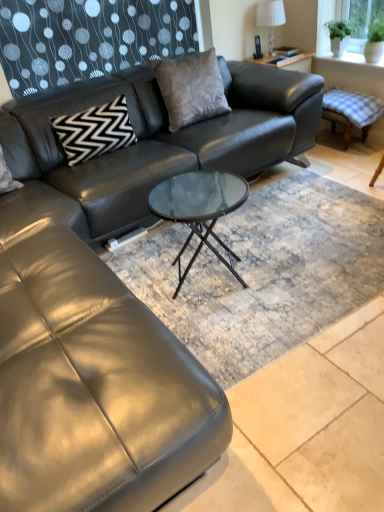
Question: Based on their sizes in the image, would you say green glass window screen at upper right is bigger or smaller than satin gray pillow at center, which appears as the 2th pillow when viewed from the left?

Choices:
 (A) small
 (B) big

Answer: (A)

Question: Is green glass window screen at upper right wider or thinner than satin gray pillow at center, which appears as the 2th pillow when viewed from the left?

Choices:
 (A) wide
 (B) thin

Answer: (A)

Question: Which object is the farthest from the satin gray pillow at center, which appears as the 2th pillow when viewed from the left?

Choices:
 (A) checkered fabric swivel chair at right
 (B) green glass window screen at upper right
 (C) black zigzag-patterned pillow at upper left, marked as the 2th pillow in a right-to-left arrangement
 (D) matte black side table at upper right
 (E) white fabric lampshade at upper right

Answer: (B)

Question: Which of these objects is positioned closest to the green glass window screen at upper right?

Choices:
 (A) satin gray pillow at center, which ranks as the first pillow in right-to-left order
 (B) white fabric lampshade at upper right
 (C) black zigzag-patterned pillow at upper left, positioned as the 1th pillow in left-to-right order
 (D) checkered fabric swivel chair at right
 (E) matte black side table at upper right

Answer: (E)